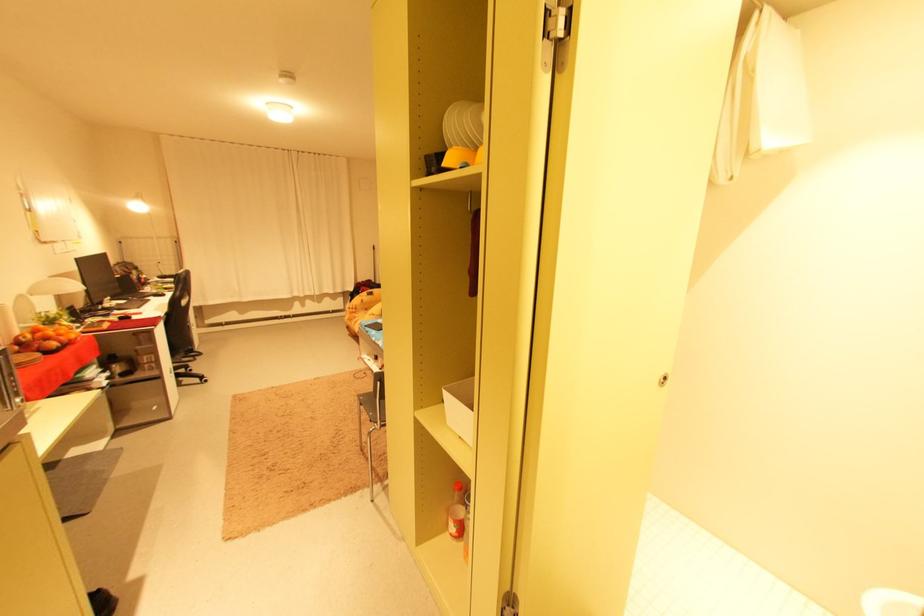
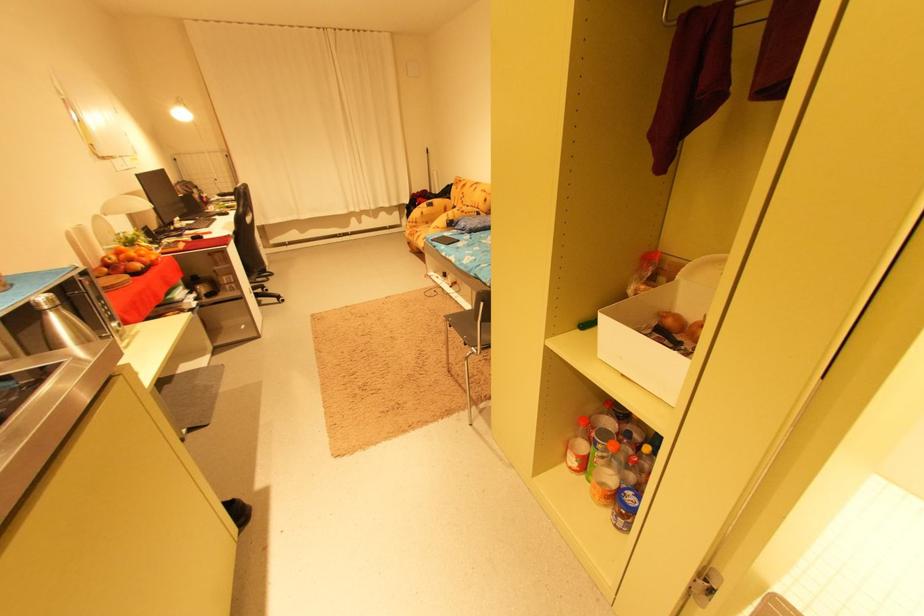
The point at (455, 536) is marked in the first image. Where is the corresponding point in the second image?

(572, 467)